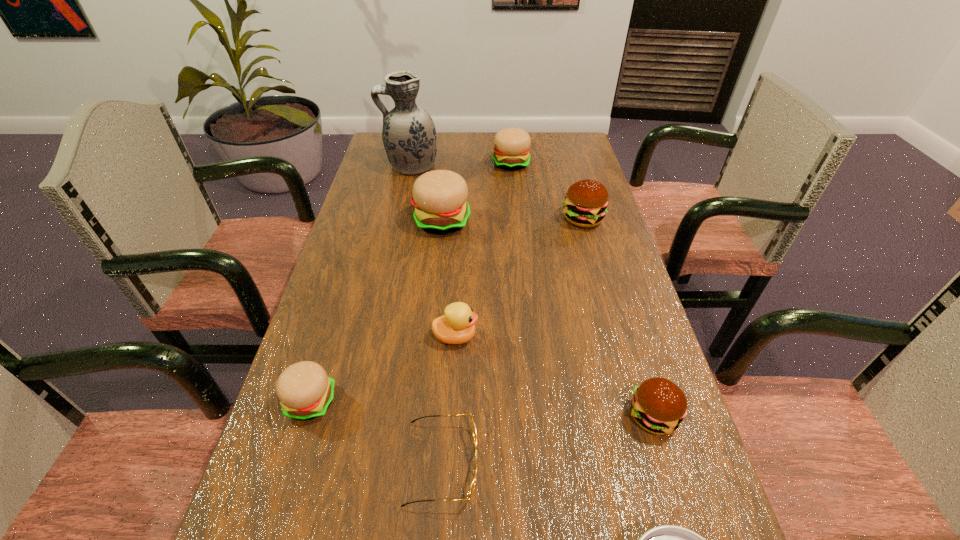
You are a GUI agent. You are given a task and a screenshot of the screen. Output one action in this format:
    pyautogui.click(x=<x>, y=<y>)
    Task: Click on the free spot that satisfies the following two spatial constraints: 1. with the handle on the side of the blue vase; 2. on the back side of the rightmost beige hamburger
    Image resolution: width=960 pixels, height=540 pixels.
    Given the screenshot: What is the action you would take?
    pyautogui.click(x=411, y=163)